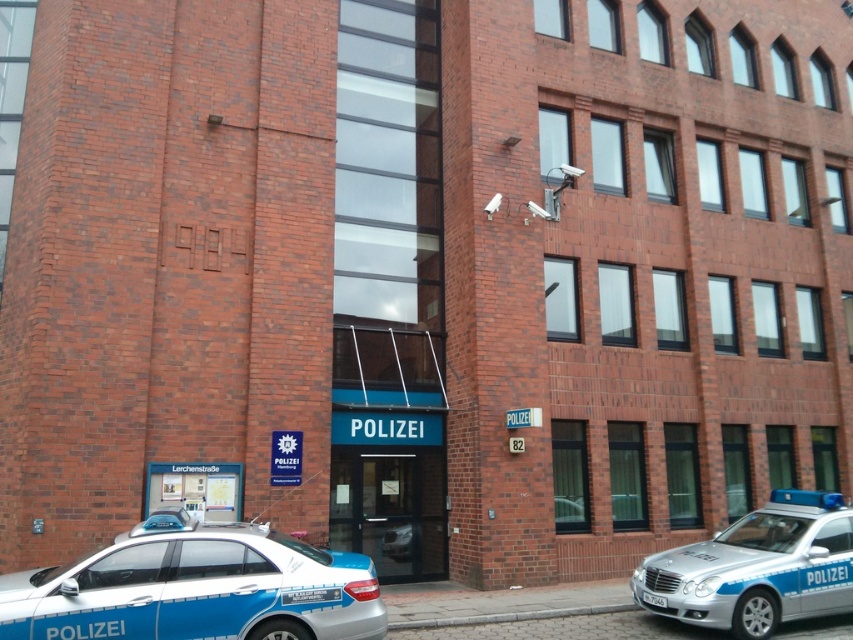
You are a photographer trying to capture both police cars in a single shot. Given that the blue metallic police car at lower left is smaller in your viewfinder compared to the silver metallic police car at lower right, which one is closer to you?

The blue metallic police car at lower left is closer to you because objects that appear smaller in the viewfinder are actually closer but appear smaller due to perspective, but wait, actually in reality closer objects appear larger. Hmm, there might be confusion here. Let me think again. If the blue car takes up less space in the viewfinder, that suggests it is farther away since it appears smaller. Therefore, the silver metallic police car at lower right is closer because it occupies more space and thus is

You are a pedestrian standing in front of the POLIZEI building. You see the blue metallic police car at lower left and the silver metallic police car at lower right. Which police car is nearer to you?

The blue metallic police car at lower left is closer to the viewer than the silver metallic police car at lower right.